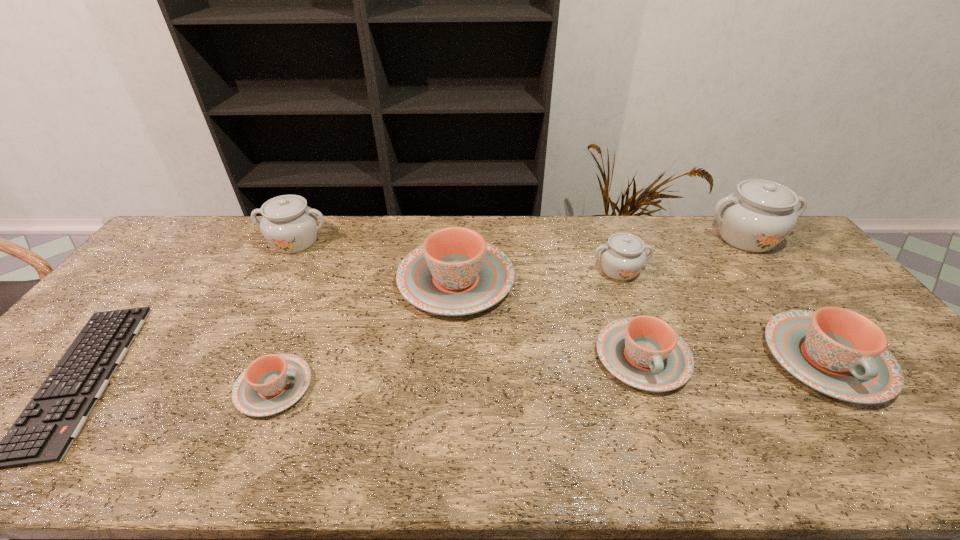
Choose which pink chinaware is the second nearest neighbor to the second shortest chinaware. Please provide its 2D coordinates. Your answer should be formatted as a tuple, i.e. [(x, y)], where the tuple contains the x and y coordinates of a point satisfying the conditions above.

[(836, 351)]

At what (x,y) coordinates should I click in order to perform the action: click on pink chinaware identified as the second closest to the smallest white chinaware. Please return your answer as a coordinate pair (x, y). The height and width of the screenshot is (540, 960). Looking at the image, I should click on (455, 272).